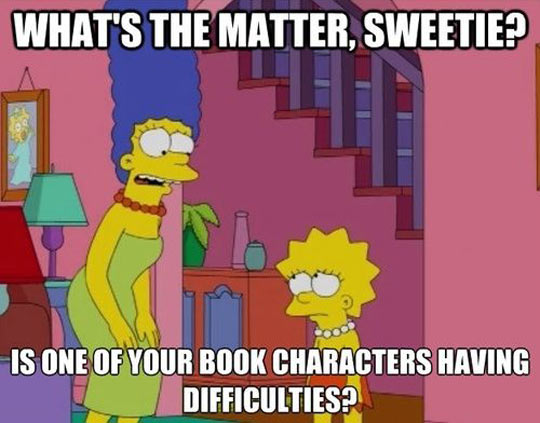
Locate an element on the screen. stairs is located at coordinates (403, 229).